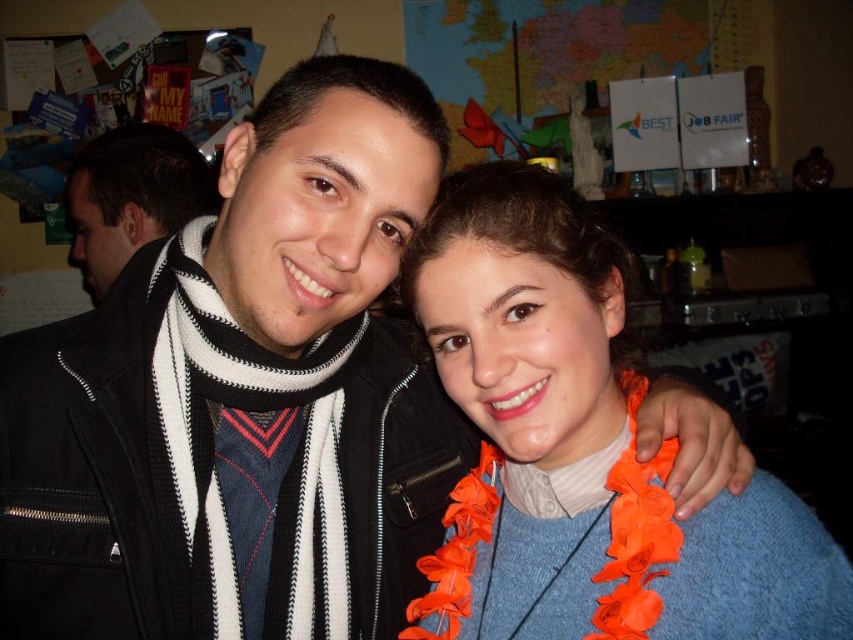
Based on the photo, you are organizing a photo shoot and want to ensure that the orange fabric lei at center and the black and white scarf at left are visible in the final image. Based on their positions, which object should you focus on first to ensure both are in focus?

The orange fabric lei at center should be focused on first because it is in front of the black and white scarf at left, so focusing on it will ensure both are in focus.

You are organizing a costume party and need to decide which accessory to use for a Hawaiian theme. The orange fabric lei at center and the black and white scarf at left are available. Which one would be more appropriate for the Hawaiian theme?

The orange fabric lei at center is more appropriate for a Hawaiian theme because it is shorter than the black and white scarf at left, which aligns with traditional Hawaiian leis typically being shorter and more decorative around the neck.

You are organizing a photo shoot and need to position two accessories correctly. You have an orange fabric lei at center and a black and white scarf at left. Based on the scene description, which accessory is positioned to the right of the other?

The orange fabric lei at center is to the right of the black and white scarf at left.